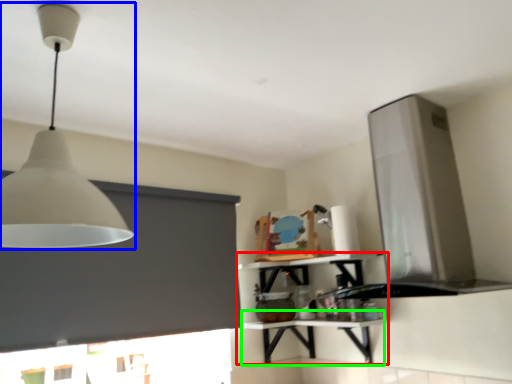
Question: Which is farther away from shelf (highlighted by a red box)? lamp (highlighted by a blue box) or table (highlighted by a green box)?

Choices:
 (A) lamp
 (B) table

Answer: (A)